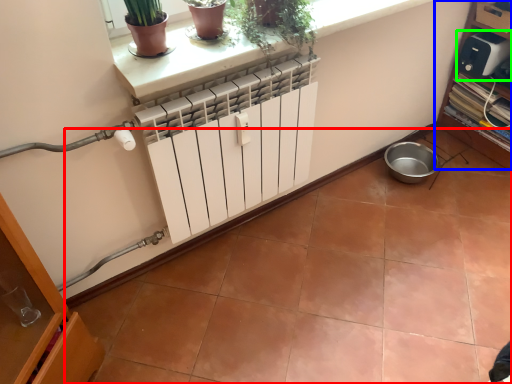
Question: Which object is the farthest from ceramic tile (highlighted by a red box)? Choose among these: shelf (highlighted by a blue box) or appliance (highlighted by a green box).

Choices:
 (A) shelf
 (B) appliance

Answer: (B)